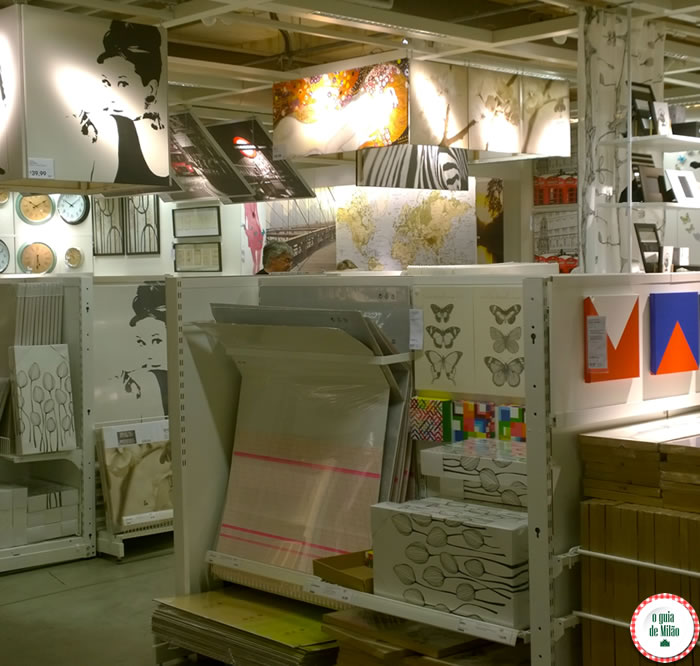
Identify the location of prints of flowers on canvas. This screenshot has height=666, width=700. (50, 397), (477, 573), (498, 466), (511, 480).